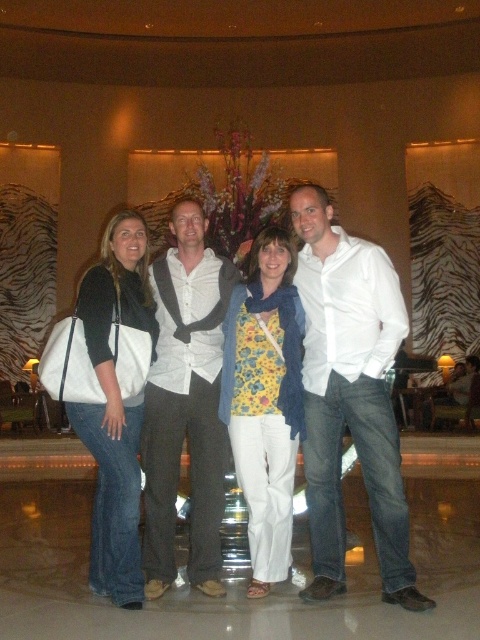
Is white matte shirt at center taller than floral print fabric at center?

Indeed, white matte shirt at center has a greater height compared to floral print fabric at center.

Does white matte shirt at center lie behind floral print fabric at center?

That is False.

Identify the location of white matte shirt at center. The height and width of the screenshot is (640, 480). (186, 404).

Based on the photo, can you confirm if white matte shirt at center is positioned to the right of matte white tote at left?

Correct, you'll find white matte shirt at center to the right of matte white tote at left.

Who is lower down, white matte shirt at center or matte white tote at left?

Positioned lower is matte white tote at left.

Is point (183, 292) less distant than point (120, 492)?

No.

Find the location of a particular element. The image size is (480, 640). white matte shirt at center is located at coordinates (186, 404).

Can you confirm if white cotton shirt at center is smaller than white matte shirt at center?

Actually, white cotton shirt at center might be larger than white matte shirt at center.

Does point (312, 472) lie in front of point (156, 260)?

That is True.

At what (x,y) coordinates should I click in order to perform the action: click on white cotton shirt at center. Please return your answer as a coordinate pair (x, y). The width and height of the screenshot is (480, 640). Looking at the image, I should click on (349, 396).